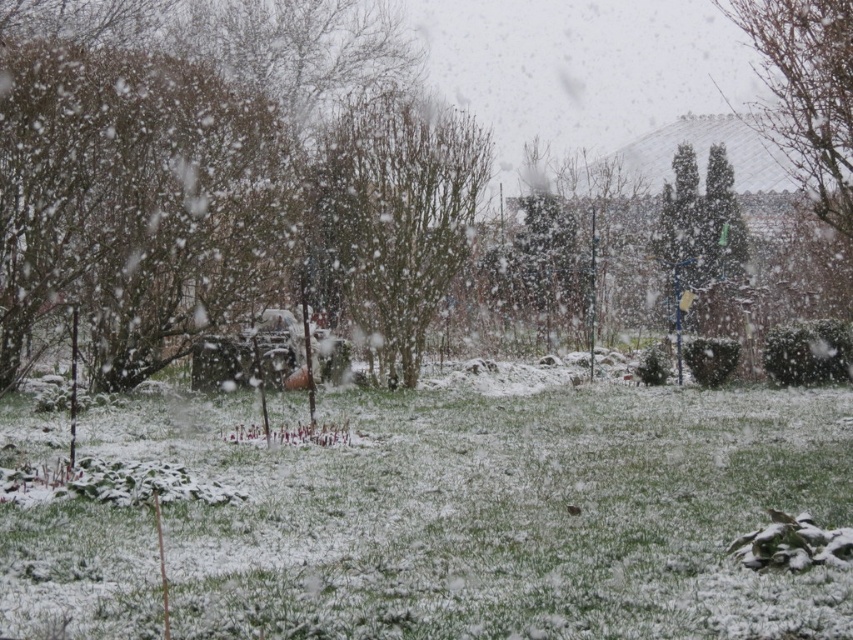
Question: Can you confirm if white snow-covered grass at lower center is smaller than bare branches at center?

Choices:
 (A) yes
 (B) no

Answer: (A)

Question: Does white snow-covered grass at lower center have a greater width compared to bare branches at center?

Choices:
 (A) no
 (B) yes

Answer: (B)

Question: Which of the following is the closest to the observer?

Choices:
 (A) white snow-covered grass at lower center
 (B) bare branches at center

Answer: (A)

Question: Is white snow-covered grass at lower center positioned before bare branches at center?

Choices:
 (A) yes
 (B) no

Answer: (A)

Question: Among these objects, which one is nearest to the camera?

Choices:
 (A) white snow-covered grass at lower center
 (B) bare branches at center

Answer: (A)